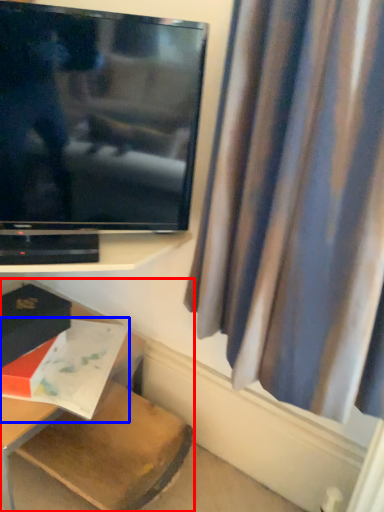
Question: Which point is further to the camera, furniture (highlighted by a red box) or book (highlighted by a blue box)?

Choices:
 (A) furniture
 (B) book

Answer: (B)